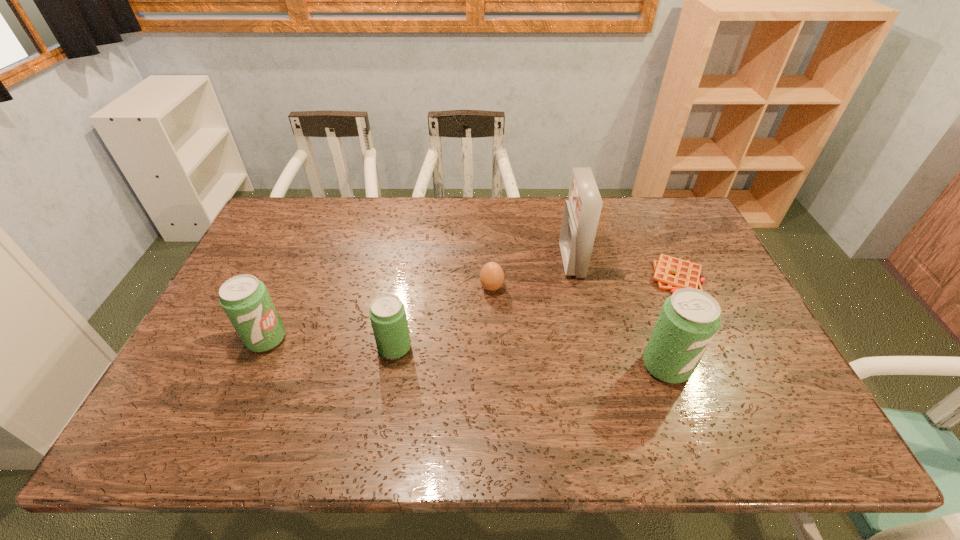
Where is `object at the right edge`? object at the right edge is located at coordinates click(x=671, y=273).

In the image, there is a desktop. At what (x,y) coordinates should I click in order to perform the action: click on free space at the far edge. Please return your answer as a coordinate pair (x, y). Image resolution: width=960 pixels, height=540 pixels. Looking at the image, I should click on (419, 230).

This screenshot has width=960, height=540. In the image, there is a desktop. In order to click on free space at the left edge in this screenshot , I will do `click(261, 240)`.

You are a GUI agent. You are given a task and a screenshot of the screen. Output one action in this format:
    pyautogui.click(x=<x>, y=<y>)
    Task: Click on the vacant space at the right edge of the desktop
    
    Given the screenshot: What is the action you would take?
    pyautogui.click(x=739, y=365)

This screenshot has width=960, height=540. Identify the location of vacant region at the far left corner. (277, 201).

Image resolution: width=960 pixels, height=540 pixels. Identify the location of vacant point at the far right corner. pos(675,215).

I want to click on free space between the rightmost soda and the second object from left to right, so [x=531, y=357].

You are a GUI agent. You are given a task and a screenshot of the screen. Output one action in this format:
    pyautogui.click(x=<x>, y=<y>)
    Task: Click on the vacant region between the shortest object and the tallest object
    The image size is (960, 540).
    Given the screenshot: What is the action you would take?
    pyautogui.click(x=624, y=269)

Locate an element on the screen. The height and width of the screenshot is (540, 960). free space between the boiled egg and the tallest object is located at coordinates (532, 274).

You are a GUI agent. You are given a task and a screenshot of the screen. Output one action in this format:
    pyautogui.click(x=<x>, y=<y>)
    Task: Click on the vacant region between the waffle and the tallest object
    
    Given the screenshot: What is the action you would take?
    tap(624, 269)